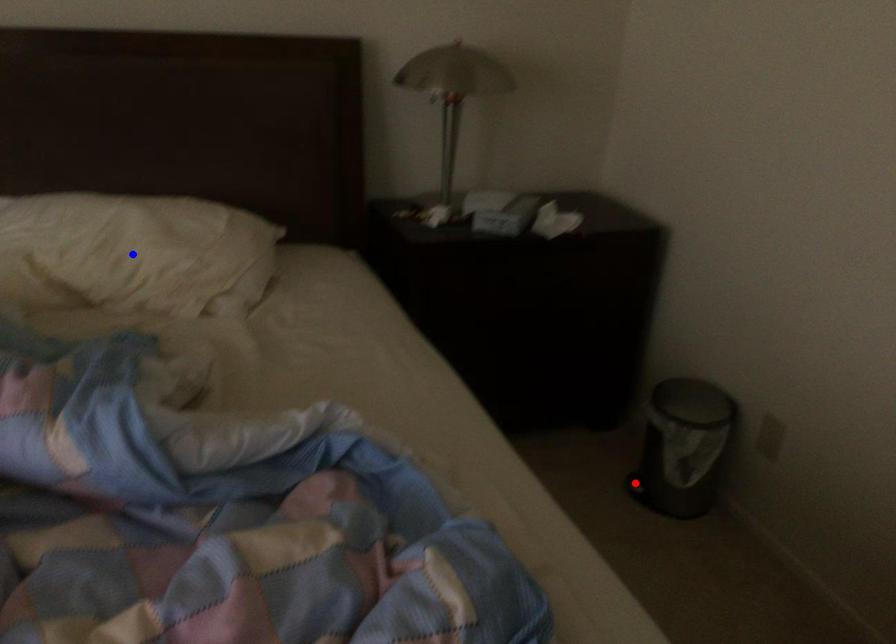
Question: Which of the two points in the image is closer to the camera?

Choices:
 (A) Blue point is closer.
 (B) Red point is closer.

Answer: (A)